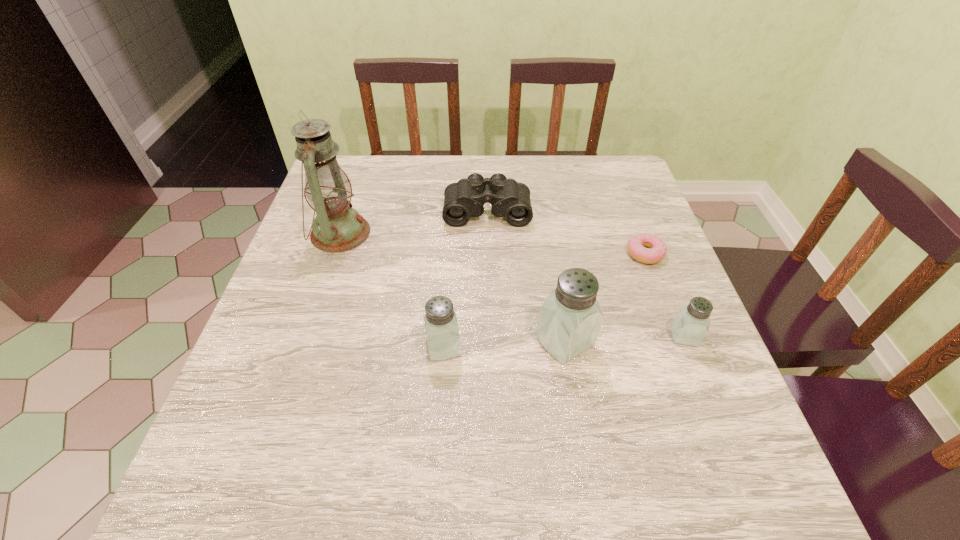
Locate an element on the screen. The image size is (960, 540). free space at the near edge of the desktop is located at coordinates (612, 393).

Locate an element on the screen. vacant space at the left edge of the desktop is located at coordinates (317, 258).

You are a GUI agent. You are given a task and a screenshot of the screen. Output one action in this format:
    pyautogui.click(x=<x>, y=<y>)
    Task: Click on the vacant space at the right edge
    The width and height of the screenshot is (960, 540).
    Given the screenshot: What is the action you would take?
    pyautogui.click(x=608, y=216)

In the image, there is a desktop. Identify the location of vacant area at the far left corner. The image size is (960, 540). (358, 186).

Image resolution: width=960 pixels, height=540 pixels. Find the location of `blank area at the near left corner`. blank area at the near left corner is located at coordinates (275, 420).

At what (x,y) coordinates should I click in order to perform the action: click on free space at the near right corner. Please return your answer as a coordinate pair (x, y). Looking at the image, I should click on (658, 410).

You are a GUI agent. You are given a task and a screenshot of the screen. Output one action in this format:
    pyautogui.click(x=<x>, y=<y>)
    Task: Click on the free space between the tallest object and the second tallest saltshaker
    
    Given the screenshot: What is the action you would take?
    pyautogui.click(x=392, y=290)

Identify the location of unoccupied area between the shortest object and the binoculars. (566, 232).

At what (x,y) coordinates should I click in order to perform the action: click on vacant region between the tallest saltshaker and the rightmost saltshaker. Please return your answer as a coordinate pair (x, y). This screenshot has width=960, height=540. Looking at the image, I should click on (625, 339).

Locate an element on the screen. Image resolution: width=960 pixels, height=540 pixels. free spot between the binoculars and the second saltshaker from left to right is located at coordinates (526, 275).